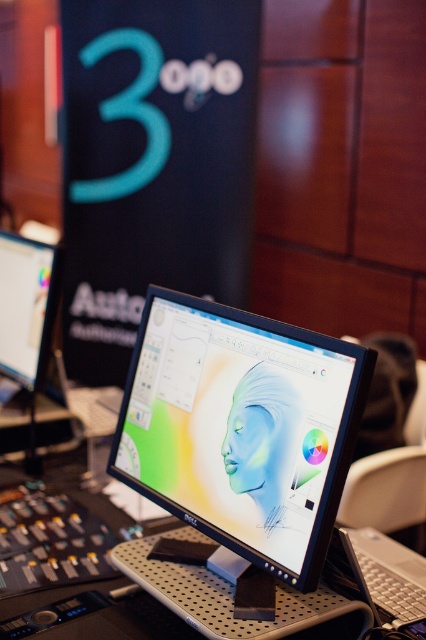
Question: Where is satin black monitor at center located in relation to matte black monitor at left in the image?

Choices:
 (A) right
 (B) left

Answer: (A)

Question: Can you confirm if satin black monitor at center is thinner than matte black monitor at left?

Choices:
 (A) no
 (B) yes

Answer: (A)

Question: Among these objects, which one is nearest to the camera?

Choices:
 (A) satin black monitor at center
 (B) matte black monitor at left

Answer: (A)

Question: Is satin black monitor at center to the right of matte black monitor at left from the viewer's perspective?

Choices:
 (A) no
 (B) yes

Answer: (B)

Question: Which point is closer to the camera?

Choices:
 (A) matte black monitor at left
 (B) satin black monitor at center

Answer: (B)

Question: Which point appears farthest from the camera in this image?

Choices:
 (A) (37, 266)
 (B) (149, 289)

Answer: (A)